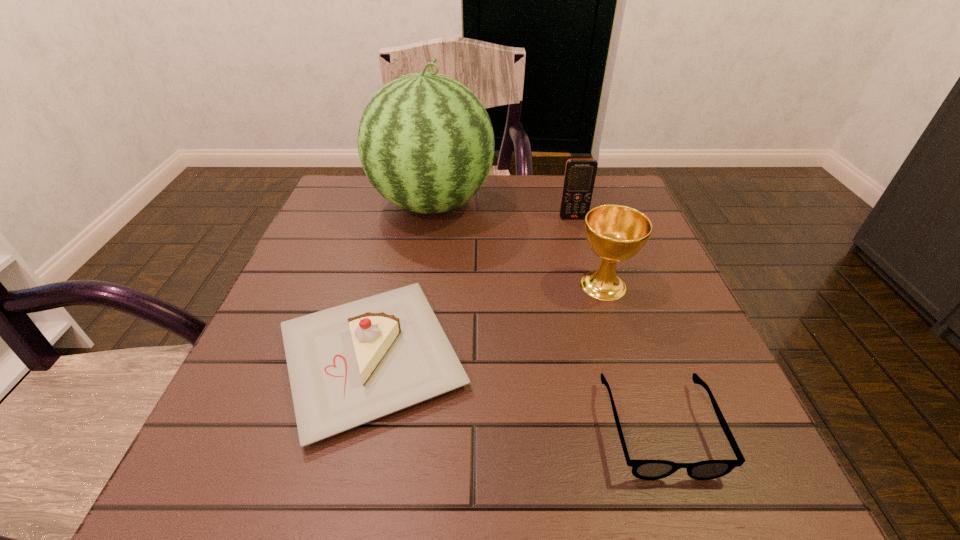
Identify the location of vacant space that satisfies the following two spatial constraints: 1. on the screen of the chalice; 2. on the left side of the cellular telephone. (592, 285).

You are a GUI agent. You are given a task and a screenshot of the screen. Output one action in this format:
    pyautogui.click(x=<x>, y=<y>)
    Task: Click on the vacant space that satisfies the following two spatial constraints: 1. on the screen of the cellular telephone; 2. on the right side of the chalice
    
    Given the screenshot: What is the action you would take?
    pyautogui.click(x=592, y=285)

At what (x,y) coordinates should I click in order to perform the action: click on free space that satisfies the following two spatial constraints: 1. on the back side of the cake; 2. on the right side of the watermelon. Please return your answer as a coordinate pair (x, y). This screenshot has height=540, width=960. Looking at the image, I should click on (407, 204).